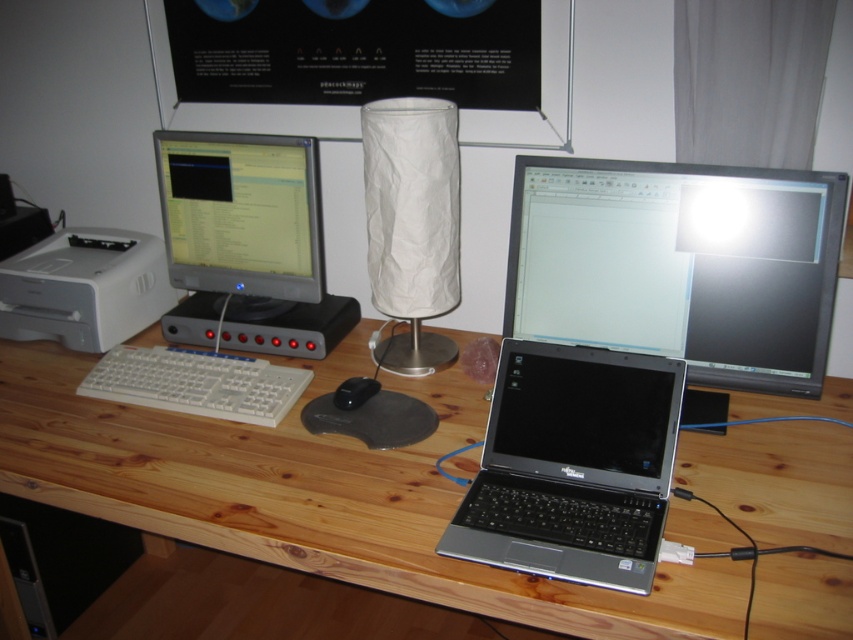
Question: Can you confirm if wooden desk at center is smaller than matte black monitor at center?

Choices:
 (A) no
 (B) yes

Answer: (A)

Question: Is white crumpled paper lampshade at center above black plastic mouse at center?

Choices:
 (A) yes
 (B) no

Answer: (A)

Question: Can you confirm if white plastic keyboard at left is thinner than black plastic mouse at center?

Choices:
 (A) no
 (B) yes

Answer: (A)

Question: Which point is closer to the camera taking this photo?

Choices:
 (A) (712, 333)
 (B) (236, 369)
 (C) (70, 378)
 (D) (376, 384)

Answer: (A)

Question: Which of these objects is positioned farthest from the satin black laptop at lower right?

Choices:
 (A) matte black monitor at center
 (B) black plastic mouse at center
 (C) white crumpled paper lampshade at center
 (D) white plastic keyboard at left

Answer: (D)

Question: Estimate the real-world distances between objects in this image. Which object is closer to the white crumpled paper lampshade at center?

Choices:
 (A) wooden desk at center
 (B) white plastic printer at left

Answer: (A)